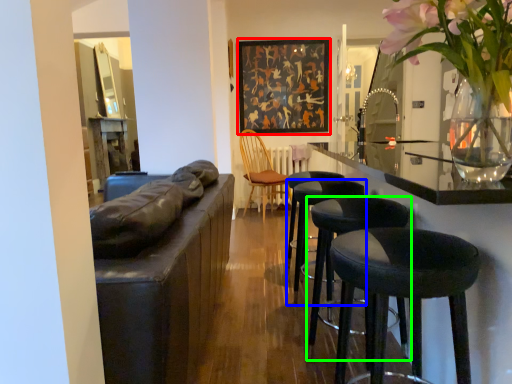
Question: Which object is the farthest from picture frame (highlighted by a red box)? Choose among these: stool (highlighted by a blue box) or stool (highlighted by a green box).

Choices:
 (A) stool
 (B) stool

Answer: (B)